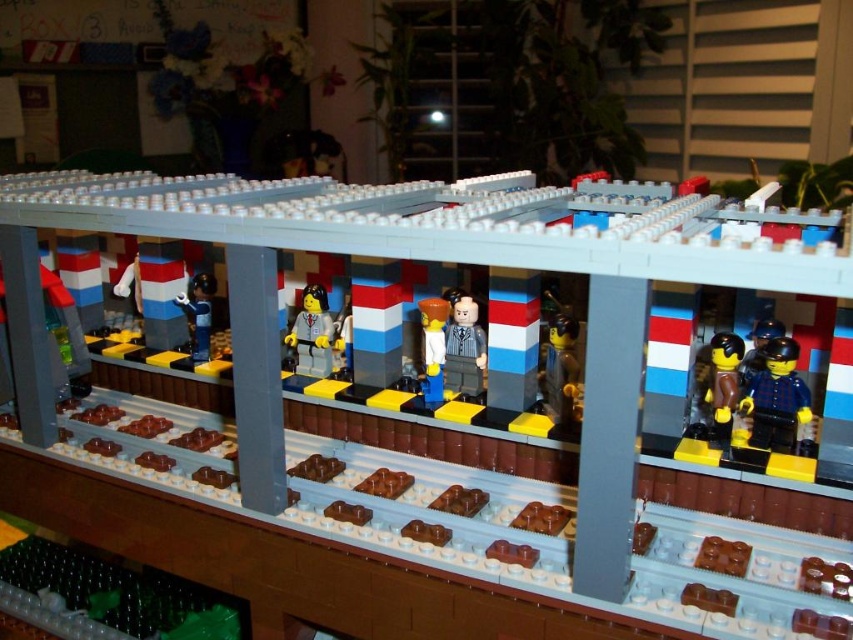
You are a LEGO architect designing a new train station. You need to place a new bench exactly at point (723, 384). According to the scene description, what object is currently located at that point?

The point (723, 384) marks the location of the brown matte minifigure at center right.

You are a LEGO minifigure trying to find your friend who is the smooth gray minifigure at center. You are currently standing next to the smooth brown minifigure at center. In which direction should you move to reach your friend?

The smooth brown minifigure at center is to the right of the smooth gray minifigure at center, so you should move to the left to reach your friend.

You are a LEGO minifigure trying to find your friend who is the translucent yellow plastic figure at center. You are currently standing at the entrance of the train station. According to the coordinates provided, in which direction should you move to locate your friend?

The translucent yellow plastic figure at center is located at coordinates approximately 54.1 cm in the x direction and 50.9 cm in the y direction. Since you are at the entrance, moving towards the center area of the station would lead you to your friend.